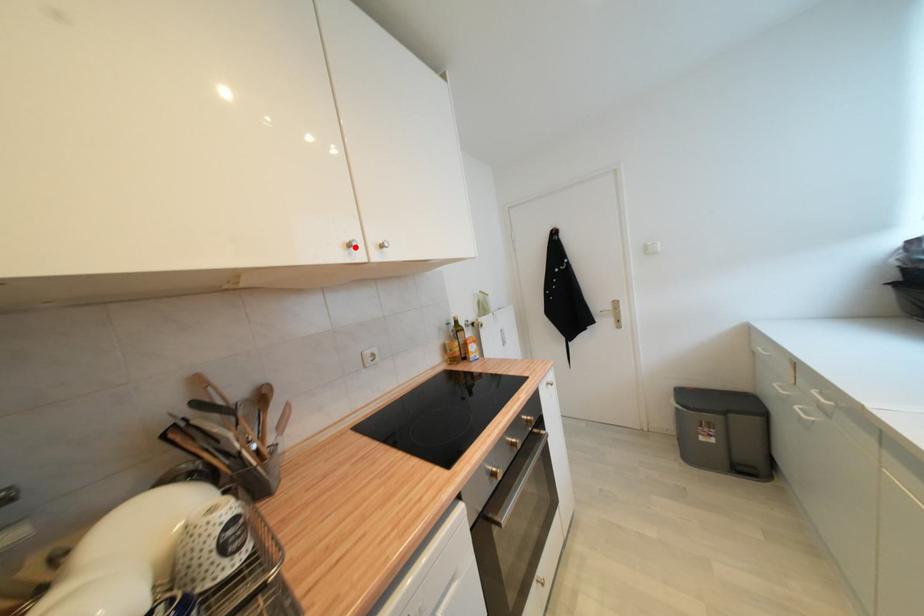
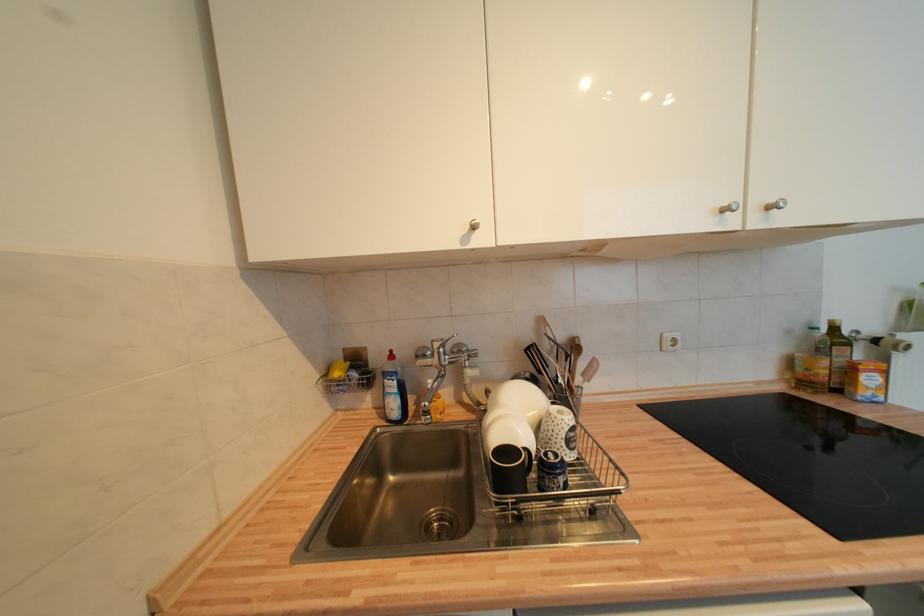
In the second image, find the point that corresponds to the highlighted location in the first image.

(730, 212)